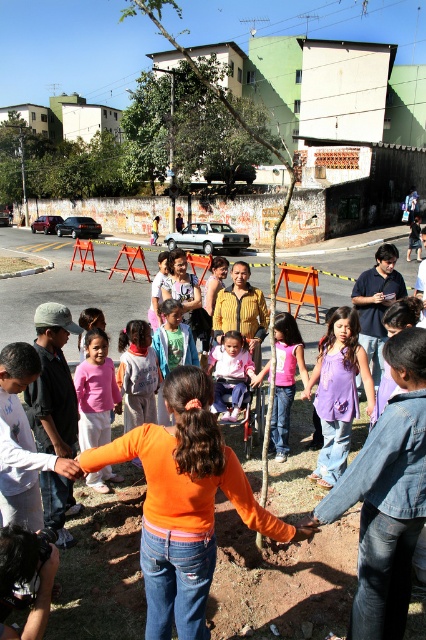
Question: Based on their relative distances, which object is nearer to the pink fabric dress at center?

Choices:
 (A) green leafy tree at upper center
 (B) purple fabric dress at center

Answer: (B)

Question: Can you confirm if purple fabric dress at center is positioned to the left of pink cotton shirt at center?

Choices:
 (A) no
 (B) yes

Answer: (A)

Question: Can you confirm if orange denim jeans at center is positioned to the right of green leafy tree at upper center?

Choices:
 (A) yes
 (B) no

Answer: (A)

Question: Can you confirm if orange denim jeans at center is bigger than purple fabric dress at center?

Choices:
 (A) yes
 (B) no

Answer: (A)

Question: Which of these objects is positioned farthest from the pink fabric shirt at center?

Choices:
 (A) purple cotton shirt at center
 (B) pink cotton shirt at center

Answer: (A)

Question: Which object is the farthest from the orange denim jeans at center?

Choices:
 (A) green leafy tree at center
 (B) purple fabric dress at center

Answer: (A)